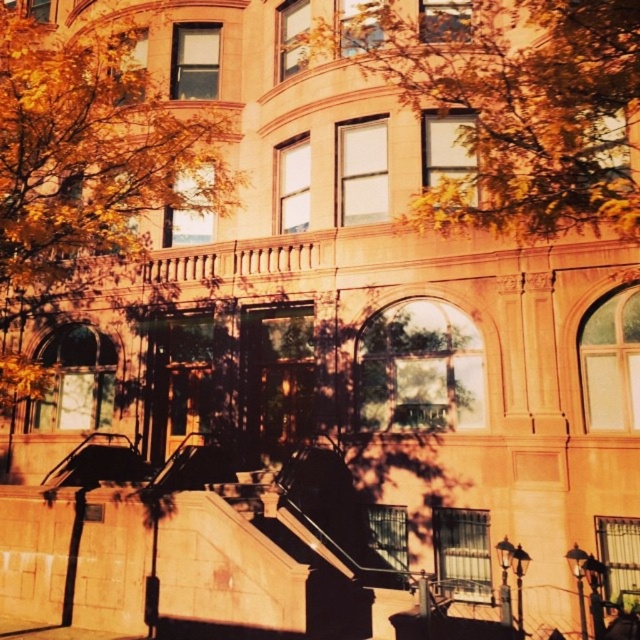
Consider the image. You are an architect analyzing the building facade. Which object takes up more space in the image, the yellow leafy tree at upper center or the golden textured leaves at center?

The golden textured leaves at center take up more space in the image than the yellow leafy tree at upper center.

You are a landscape architect designing a pathway that must pass between the yellow leafy tree at upper center and the golden textured leaves at center. What is the minimum width required for the pathway to ensure it fits between them?

The minimum width required for the pathway is 8.65 meters, as the distance between the yellow leafy tree at upper center and the golden textured leaves at center is exactly 8.65 meters.

You are standing at the base of the steps leading to the grand building. You notice a point marked at coordinates (515,106). Based on the scene, where is this point located?

The point marked at coordinates (515,106) is located on the yellow leafy tree at upper center.